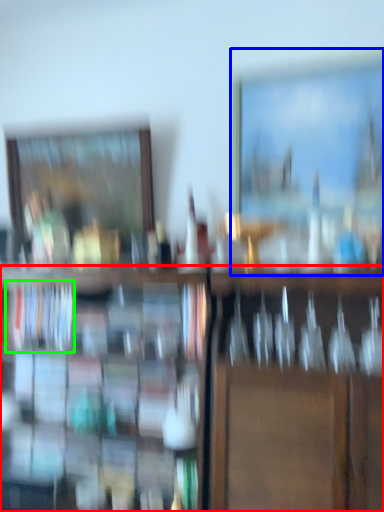
Question: Considering the real-world distances, which object is farthest from shelf (highlighted by a red box)? picture frame (highlighted by a blue box) or book (highlighted by a green box)?

Choices:
 (A) picture frame
 (B) book

Answer: (A)